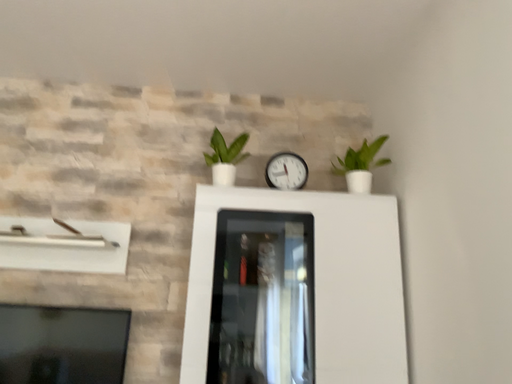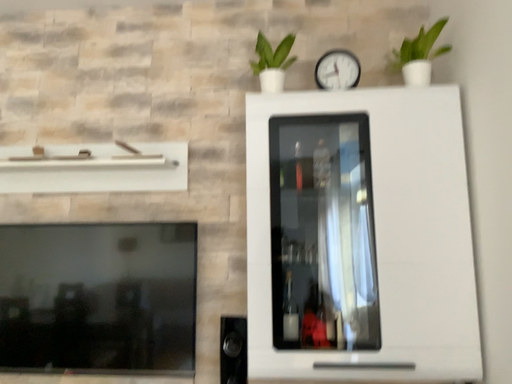
Question: Which way did the camera rotate in the video?

Choices:
 (A) rotated upward
 (B) rotated downward

Answer: (B)